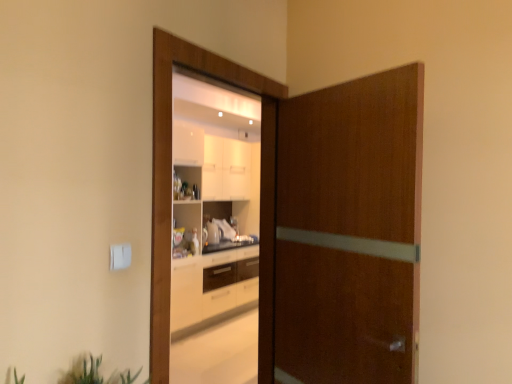
Describe the element at coordinates (349, 231) in the screenshot. The width and height of the screenshot is (512, 384). I see `brown wood door at center, the first screen door positioned from the right` at that location.

This screenshot has height=384, width=512. Describe the element at coordinates (94, 373) in the screenshot. I see `green leafy plant at lower left` at that location.

I want to click on brown wood door at center, the first screen door positioned from the right, so click(x=349, y=231).

Considering the relative sizes of green leafy plant at lower left and wooden door at center, marked as the 1th screen door in a left-to-right arrangement, in the image provided, is green leafy plant at lower left taller than wooden door at center, marked as the 1th screen door in a left-to-right arrangement,?

In fact, green leafy plant at lower left may be shorter than wooden door at center, marked as the 1th screen door in a left-to-right arrangement.

In the scene shown: Considering the sizes of objects green leafy plant at lower left and wooden door at center, which is the 2th screen door in right-to-left order, in the image provided, who is smaller, green leafy plant at lower left or wooden door at center, which is the 2th screen door in right-to-left order,?

Smaller between the two is green leafy plant at lower left.

Consider the image. From a real-world perspective, is green leafy plant at lower left on wooden door at center, marked as the 1th screen door in a left-to-right arrangement?

No, from a real-world perspective, green leafy plant at lower left is not on top of wooden door at center, marked as the 1th screen door in a left-to-right arrangement.

Is wooden door at center, which is the 2th screen door in right-to-left order, completely or partially inside green leafy plant at lower left?

Definitely not — wooden door at center, which is the 2th screen door in right-to-left order, is not inside green leafy plant at lower left.

From a real-world perspective, is brown wood door at center, the 2th screen door viewed from the left, positioned over wooden door at center, marked as the 1th screen door in a left-to-right arrangement, based on gravity?

No, from a real-world perspective, brown wood door at center, the 2th screen door viewed from the left, is not on top of wooden door at center, marked as the 1th screen door in a left-to-right arrangement.

Is point (283, 227) closer to viewer compared to point (271, 294)?

Yes, it is.

From the image's perspective, who appears lower, brown wood door at center, the 2th screen door viewed from the left, or wooden door at center, marked as the 1th screen door in a left-to-right arrangement?

brown wood door at center, the 2th screen door viewed from the left.

Which object is thinner, brown wood door at center, the 2th screen door viewed from the left, or wooden door at center, which is the 2th screen door in right-to-left order?

With smaller width is wooden door at center, which is the 2th screen door in right-to-left order.

Does wooden door at center, marked as the 1th screen door in a left-to-right arrangement, have a larger size compared to brown wood door at center, the 2th screen door viewed from the left?

No, wooden door at center, marked as the 1th screen door in a left-to-right arrangement, is not bigger than brown wood door at center, the 2th screen door viewed from the left.

Is wooden door at center, which is the 2th screen door in right-to-left order, in front of brown wood door at center, the 2th screen door viewed from the left?

No, wooden door at center, which is the 2th screen door in right-to-left order, is behind brown wood door at center, the 2th screen door viewed from the left.

Is point (237, 72) closer to camera compared to point (288, 263)?

That is True.

Is wooden door at center, which is the 2th screen door in right-to-left order, oriented away from brown wood door at center, the 2th screen door viewed from the left?

Absolutely, wooden door at center, which is the 2th screen door in right-to-left order, is directed away from brown wood door at center, the 2th screen door viewed from the left.

Between wooden door at center, marked as the 1th screen door in a left-to-right arrangement, and green leafy plant at lower left, which one has larger width?

green leafy plant at lower left.

Is wooden door at center, which is the 2th screen door in right-to-left order, smaller than green leafy plant at lower left?

Actually, wooden door at center, which is the 2th screen door in right-to-left order, might be larger than green leafy plant at lower left.

Can you tell me how much wooden door at center, which is the 2th screen door in right-to-left order, and green leafy plant at lower left differ in facing direction?

The angle between the facing direction of wooden door at center, which is the 2th screen door in right-to-left order, and the facing direction of green leafy plant at lower left is 1.27 degrees.

Is wooden door at center, which is the 2th screen door in right-to-left order, positioned far away from green leafy plant at lower left?

wooden door at center, which is the 2th screen door in right-to-left order, is actually quite close to green leafy plant at lower left.

Who is bigger, brown wood door at center, the first screen door positioned from the right, or green leafy plant at lower left?

→ brown wood door at center, the first screen door positioned from the right.

From their relative heights in the image, would you say brown wood door at center, the 2th screen door viewed from the left, is taller or shorter than green leafy plant at lower left?

Clearly, brown wood door at center, the 2th screen door viewed from the left, is taller compared to green leafy plant at lower left.

Which is behind, brown wood door at center, the first screen door positioned from the right, or green leafy plant at lower left?

brown wood door at center, the first screen door positioned from the right.

Looking at this image, can you tell me how much brown wood door at center, the 2th screen door viewed from the left, and green leafy plant at lower left differ in facing direction?

brown wood door at center, the 2th screen door viewed from the left, and green leafy plant at lower left are facing 110 degrees away from each other.

From the image's perspective, is green leafy plant at lower left above or below brown wood door at center, the 2th screen door viewed from the left?

green leafy plant at lower left is below brown wood door at center, the 2th screen door viewed from the left.

Consider the image. Considering the sizes of objects green leafy plant at lower left and brown wood door at center, the first screen door positioned from the right, in the image provided, who is taller, green leafy plant at lower left or brown wood door at center, the first screen door positioned from the right,?

Standing taller between the two is brown wood door at center, the first screen door positioned from the right.

Is green leafy plant at lower left turned away from brown wood door at center, the first screen door positioned from the right?

That's not correct — green leafy plant at lower left is not looking away from brown wood door at center, the first screen door positioned from the right.

I want to click on screen door that is the 2nd object above the green leafy plant at lower left (from a real-world perspective), so click(169, 190).

Find the location of `screen door above the brown wood door at center, the 2th screen door viewed from the left (from the image's perspective)`. screen door above the brown wood door at center, the 2th screen door viewed from the left (from the image's perspective) is located at coordinates (169, 190).

Which object lies nearer to the anchor point green leafy plant at lower left, wooden door at center, marked as the 1th screen door in a left-to-right arrangement, or brown wood door at center, the first screen door positioned from the right?

wooden door at center, marked as the 1th screen door in a left-to-right arrangement, lies closer to green leafy plant at lower left than the other object.

Which object lies further to the anchor point brown wood door at center, the first screen door positioned from the right, wooden door at center, marked as the 1th screen door in a left-to-right arrangement, or green leafy plant at lower left?

Based on the image, green leafy plant at lower left appears to be further to brown wood door at center, the first screen door positioned from the right.

Considering their positions, is green leafy plant at lower left positioned further to wooden door at center, which is the 2th screen door in right-to-left order, than brown wood door at center, the 2th screen door viewed from the left?

green leafy plant at lower left is positioned further to the anchor wooden door at center, which is the 2th screen door in right-to-left order.

Which object lies further to the anchor point brown wood door at center, the first screen door positioned from the right, green leafy plant at lower left or wooden door at center, marked as the 1th screen door in a left-to-right arrangement?

green leafy plant at lower left is positioned further to the anchor brown wood door at center, the first screen door positioned from the right.

Considering their positions, is brown wood door at center, the first screen door positioned from the right, positioned further to wooden door at center, marked as the 1th screen door in a left-to-right arrangement, than green leafy plant at lower left?

green leafy plant at lower left is positioned further to the anchor wooden door at center, marked as the 1th screen door in a left-to-right arrangement.

From the image, which object appears to be nearer to green leafy plant at lower left, brown wood door at center, the 2th screen door viewed from the left, or wooden door at center, which is the 2th screen door in right-to-left order?

wooden door at center, which is the 2th screen door in right-to-left order.

This screenshot has width=512, height=384. I want to click on screen door between green leafy plant at lower left and brown wood door at center, the 2th screen door viewed from the left, from left to right, so click(169, 190).